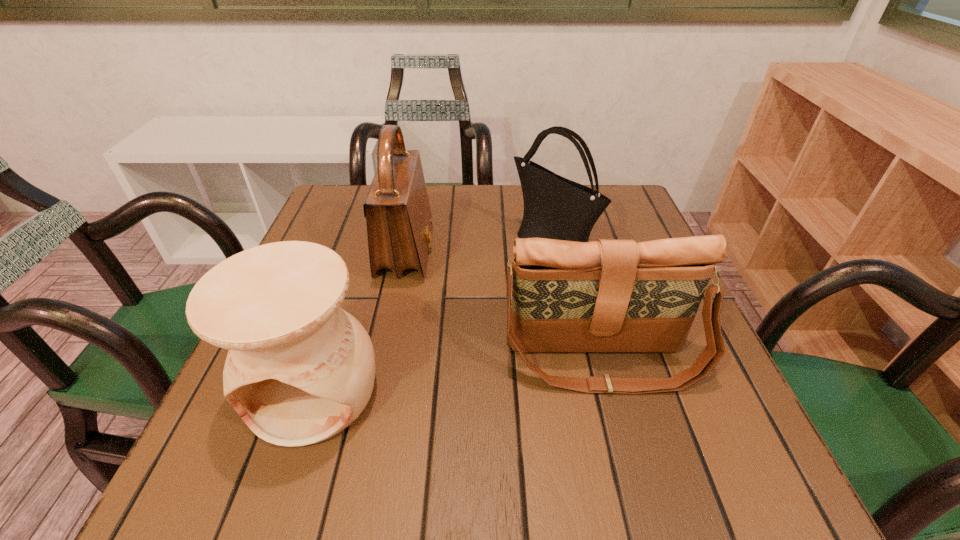
Locate an element on the screen. This screenshot has height=540, width=960. blank space at the near edge is located at coordinates (386, 494).

Locate an element on the screen. The height and width of the screenshot is (540, 960). vacant space at the left edge is located at coordinates [x=360, y=262].

Image resolution: width=960 pixels, height=540 pixels. What are the coordinates of `unoccupied position between the shortest shoulder bag and the pottery` in the screenshot? It's located at (458, 375).

Identify the location of free space between the pottery and the shortest shoulder bag. pos(458,375).

The height and width of the screenshot is (540, 960). What are the coordinates of `free spot between the pottery and the nearest shoulder bag` in the screenshot? It's located at (458, 375).

This screenshot has width=960, height=540. What are the coordinates of `vacant region between the leftmost shoulder bag and the pottery` in the screenshot? It's located at (360, 321).

Identify the location of unoccupied area between the shortest shoulder bag and the leftmost shoulder bag. (504, 306).

You are a GUI agent. You are given a task and a screenshot of the screen. Output one action in this format:
    pyautogui.click(x=<x>, y=<y>)
    Task: Click on the vacant region between the nearest shoulder bag and the pottery
    
    Given the screenshot: What is the action you would take?
    pyautogui.click(x=458, y=375)

Identify which object is the second nearest to the pottery. Please provide its 2D coordinates. Your answer should be formatted as a tuple, i.e. [(x, y)], where the tuple contains the x and y coordinates of a point satisfying the conditions above.

[(606, 295)]

Locate an element on the screen. The width and height of the screenshot is (960, 540). the second closest object to the leftmost shoulder bag is located at coordinates (557, 208).